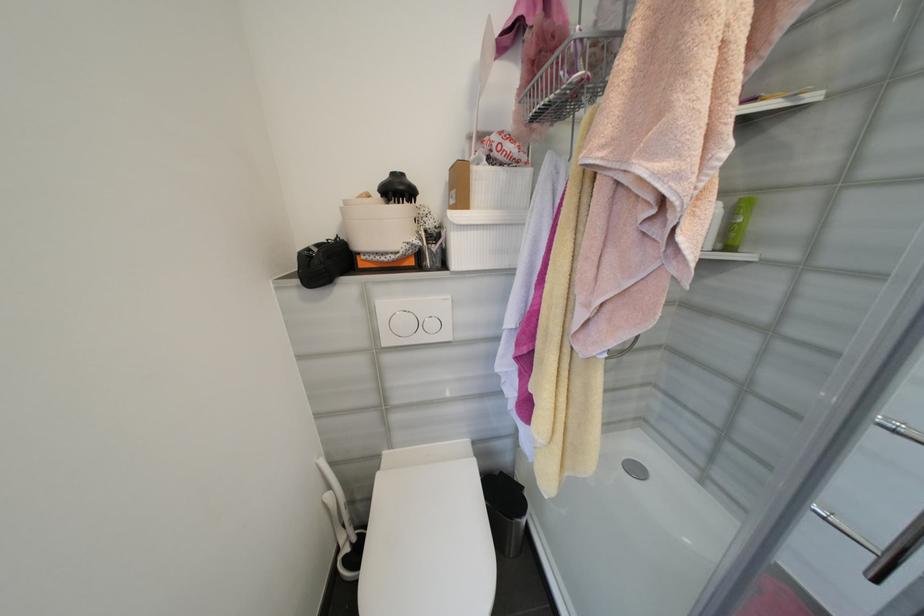
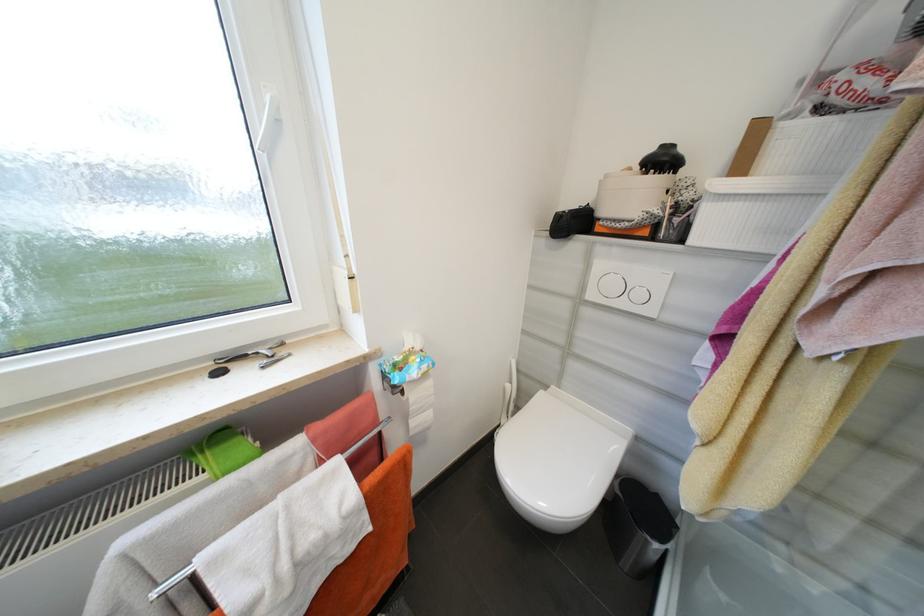
In the second image, find the point that corresponds to point (334, 496) in the first image.

(514, 387)